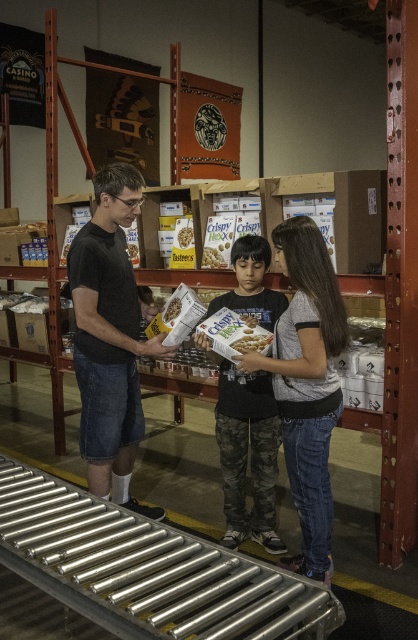
Question: Can you confirm if matte gray shirt at center is bigger than white matte cereal box at center?

Choices:
 (A) yes
 (B) no

Answer: (A)

Question: Estimate the real-world distances between objects in this image. Which object is closer to the white cardboard cereal box at center?

Choices:
 (A) white cardboard box at center
 (B) white matte cereal box at center
 (C) white cardboard box of batten's at center

Answer: (A)

Question: Is matte gray shirt at center above white cardboard box at center?

Choices:
 (A) no
 (B) yes

Answer: (A)

Question: Which of the following is the farthest from the observer?

Choices:
 (A) white matte cereal box at center
 (B) matte black shirt at center
 (C) white cardboard cereal box at center

Answer: (C)

Question: Does camouflage pants at center appear over white cardboard box of batten's at center?

Choices:
 (A) yes
 (B) no

Answer: (B)

Question: Which point appears farthest from the camera in this image?

Choices:
 (A) (234, 541)
 (B) (178, 310)
 (C) (81, 438)
 (D) (305, 284)

Answer: (B)